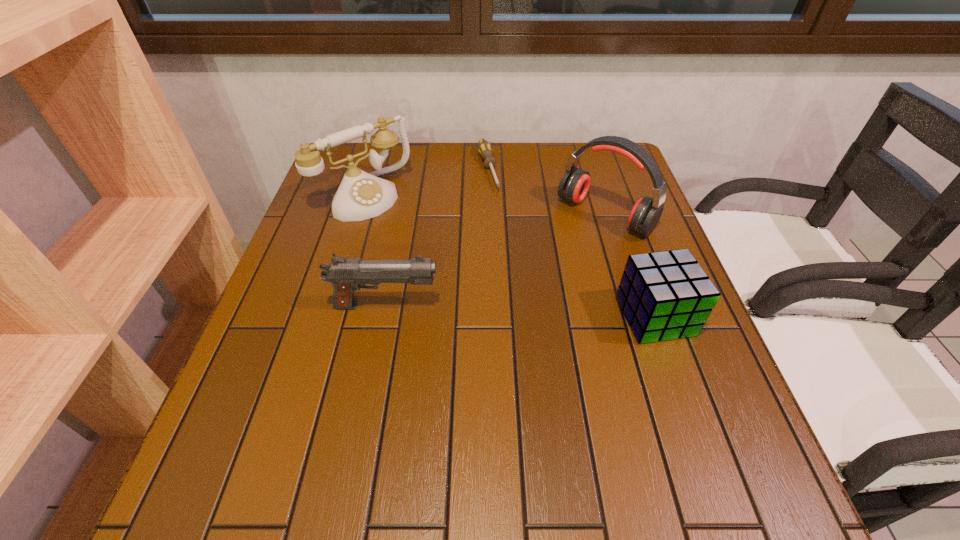
In order to click on free space that satisfies the following two spatial constraints: 1. on the front side of the earphone; 2. on the left side of the telephone in this screenshot , I will do `click(358, 215)`.

Find the location of a particular element. Image resolution: width=960 pixels, height=540 pixels. free space that satisfies the following two spatial constraints: 1. on the front side of the telephone; 2. in the direction the gun is aimed is located at coordinates (330, 306).